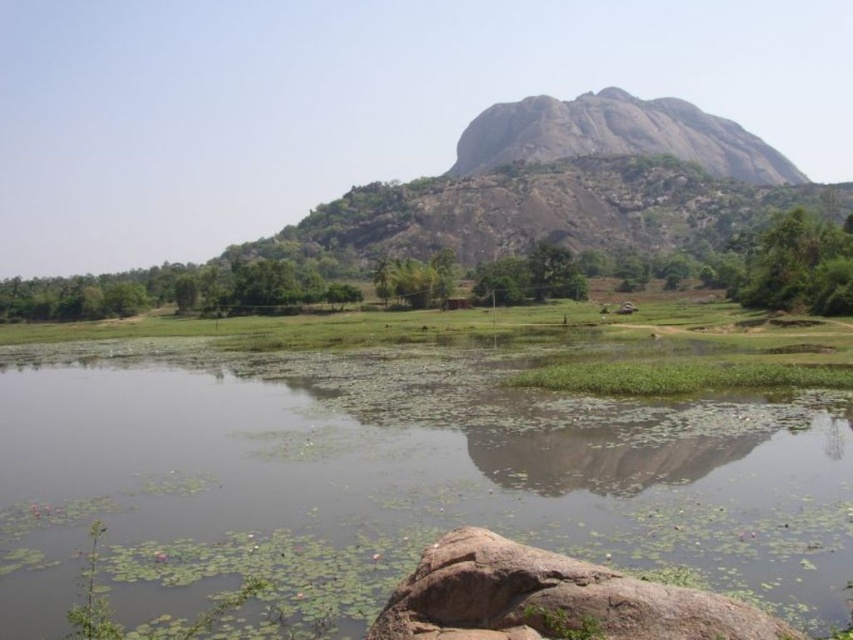
Does granite rock at lower center have a lesser height compared to green grassy field at center?

Yes, granite rock at lower center is shorter than green grassy field at center.

Is point (515, 595) positioned behind point (345, 332)?

No, it is in front of (345, 332).

Image resolution: width=853 pixels, height=640 pixels. Identify the location of granite rock at lower center. (552, 600).

Does point (479, 141) lie behind point (776, 248)?

Yes, point (479, 141) is farther from viewer.

Is point (451, 164) in front of point (808, 278)?

That is False.

This screenshot has width=853, height=640. I want to click on rough granite mountain at center, so click(618, 134).

You are a GUI agent. You are given a task and a screenshot of the screen. Output one action in this format:
    pyautogui.click(x=<x>, y=<y>)
    Task: Click on the green leafy water at center
    The height and width of the screenshot is (640, 853).
    Given the screenshot: What is the action you would take?
    pyautogui.click(x=392, y=480)

Does green leafy water at center appear over rough granite mountain at center?

No.

Who is more forward, (654, 456) or (519, 102)?

Positioned in front is point (654, 456).

Image resolution: width=853 pixels, height=640 pixels. I want to click on green leafy water at center, so click(392, 480).